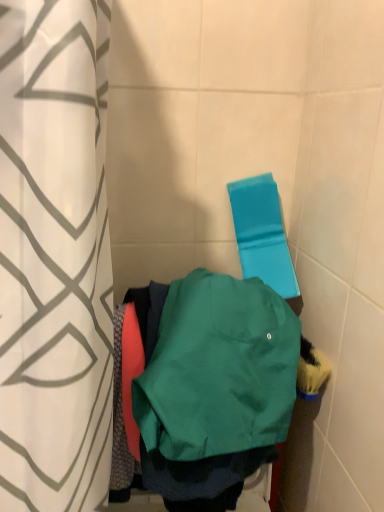
Question: From the image's perspective, would you say blue fabric beach towel at upper right is shown under white fabric curtain at left?

Choices:
 (A) no
 (B) yes

Answer: (A)

Question: Can you confirm if blue fabric beach towel at upper right is wider than white fabric curtain at left?

Choices:
 (A) yes
 (B) no

Answer: (B)

Question: Is blue fabric beach towel at upper right facing away from white fabric curtain at left?

Choices:
 (A) yes
 (B) no

Answer: (B)

Question: Can you confirm if blue fabric beach towel at upper right is taller than white fabric curtain at left?

Choices:
 (A) no
 (B) yes

Answer: (A)

Question: Does blue fabric beach towel at upper right appear on the left side of white fabric curtain at left?

Choices:
 (A) no
 (B) yes

Answer: (A)

Question: Can you confirm if blue fabric beach towel at upper right is positioned to the right of white fabric curtain at left?

Choices:
 (A) yes
 (B) no

Answer: (A)

Question: Does blue fabric beach towel at upper right come in front of green matte sweatshirt at center?

Choices:
 (A) yes
 (B) no

Answer: (B)

Question: Does blue fabric beach towel at upper right have a larger size compared to green matte sweatshirt at center?

Choices:
 (A) no
 (B) yes

Answer: (A)

Question: Does blue fabric beach towel at upper right appear on the left side of green matte sweatshirt at center?

Choices:
 (A) no
 (B) yes

Answer: (A)

Question: From a real-world perspective, is blue fabric beach towel at upper right physically below green matte sweatshirt at center?

Choices:
 (A) no
 (B) yes

Answer: (A)

Question: From the image's perspective, is blue fabric beach towel at upper right on top of green matte sweatshirt at center?

Choices:
 (A) no
 (B) yes

Answer: (B)

Question: Is blue fabric beach towel at upper right completely or partially outside of green matte sweatshirt at center?

Choices:
 (A) no
 (B) yes

Answer: (B)

Question: Can we say white fabric curtain at left lies outside blue fabric beach towel at upper right?

Choices:
 (A) yes
 (B) no

Answer: (A)